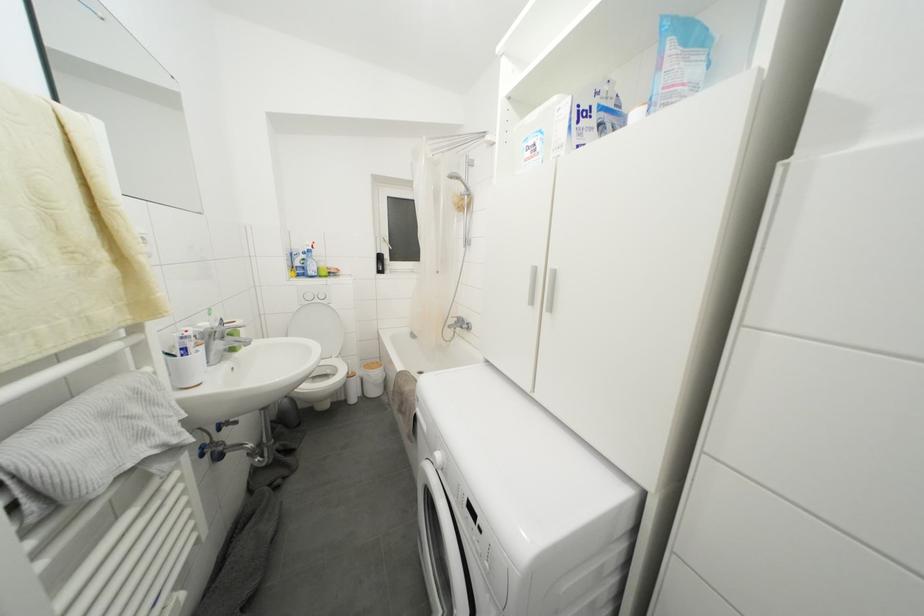
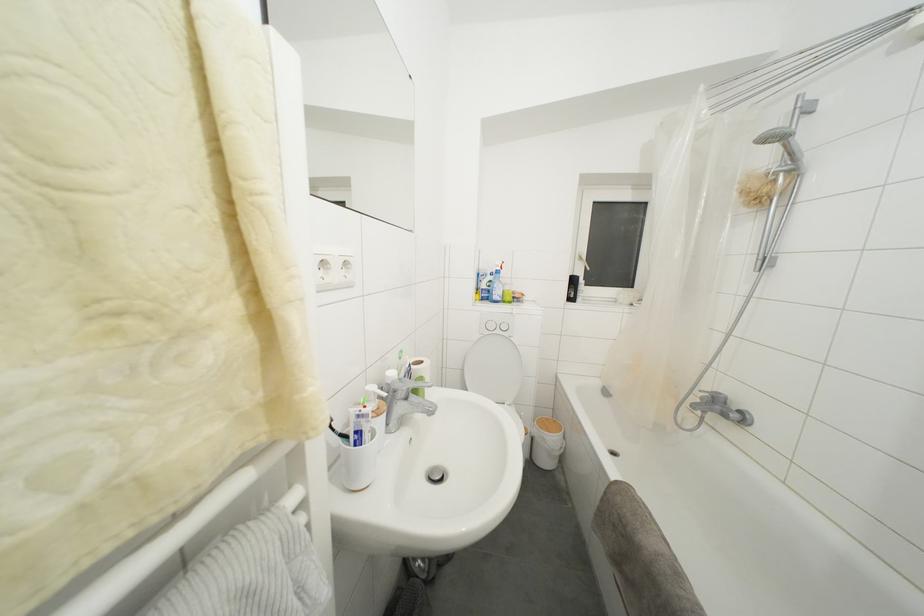
Question: The camera is either moving clockwise (left) or counter-clockwise (right) around the object. The first image is from the beginning of the video and the second image is from the end. Is the camera moving left or right when shooting the video?

Choices:
 (A) Left
 (B) Right

Answer: (B)